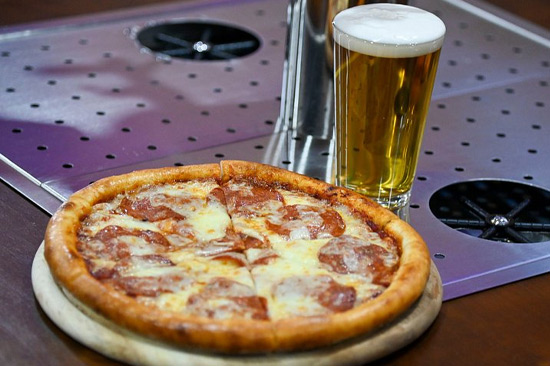
Image resolution: width=550 pixels, height=366 pixels. What are the coordinates of `pint glass` in the screenshot? It's located at (374, 130).